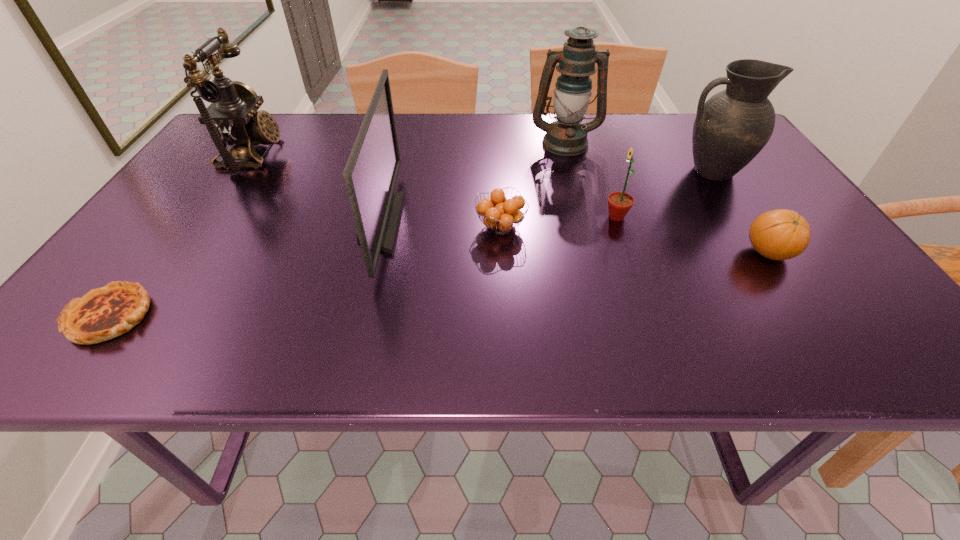
The image size is (960, 540). What are the coordinates of `object located in the far left corner section of the desktop` in the screenshot? It's located at (232, 118).

At what (x,y) coordinates should I click in order to perform the action: click on object situated at the near left corner. Please return your answer as a coordinate pair (x, y). The height and width of the screenshot is (540, 960). Looking at the image, I should click on (104, 313).

You are a GUI agent. You are given a task and a screenshot of the screen. Output one action in this format:
    pyautogui.click(x=<x>, y=<y>)
    Task: Click on the object that is at the far right corner
    Image resolution: width=960 pixels, height=540 pixels.
    Given the screenshot: What is the action you would take?
    pos(732,127)

Locate an element on the screen. This screenshot has height=540, width=960. vacant space at the far edge of the desktop is located at coordinates (352, 130).

This screenshot has height=540, width=960. In the image, there is a desktop. In order to click on vacant space at the left edge in this screenshot , I will do `click(232, 192)`.

In the image, there is a desktop. Where is `vacant region at the right edge`? Image resolution: width=960 pixels, height=540 pixels. vacant region at the right edge is located at coordinates (763, 184).

I want to click on vacant area that lies between the right orange fruit and the sunflower, so click(692, 235).

Where is `free space between the pitcher and the telephone`? free space between the pitcher and the telephone is located at coordinates (482, 163).

Locate an element on the screen. vacant region between the telephone and the sunflower is located at coordinates (435, 186).

Locate an element on the screen. Image resolution: width=960 pixels, height=540 pixels. free spot between the telephone and the quiche is located at coordinates point(181,235).